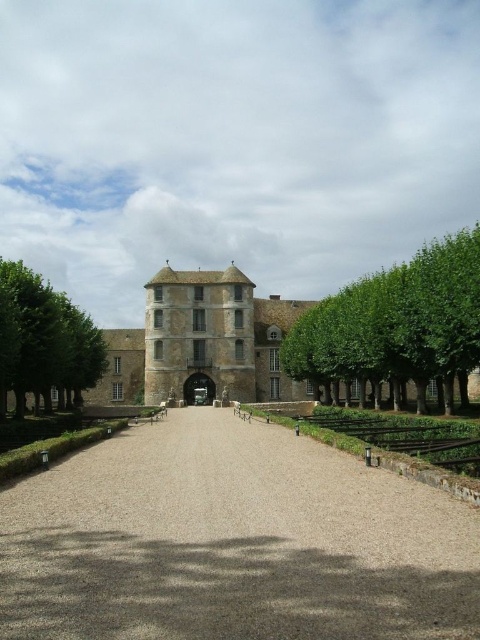
Question: Can you confirm if gray gravel driveway at center is bigger than green leafy tree at center?

Choices:
 (A) yes
 (B) no

Answer: (B)

Question: Which of the following is the farthest from the observer?

Choices:
 (A) click(182, 589)
 (B) click(295, 339)

Answer: (B)

Question: Does gray gravel driveway at center appear on the left side of green leafy tree at left?

Choices:
 (A) yes
 (B) no

Answer: (B)

Question: Does green leafy tree at center appear on the right side of green leafy tree at left?

Choices:
 (A) no
 (B) yes

Answer: (B)

Question: Estimate the real-world distances between objects in this image. Which object is farther from the green leafy tree at center?

Choices:
 (A) green leafy tree at left
 (B) gray gravel driveway at center

Answer: (A)

Question: Which object appears closest to the camera in this image?

Choices:
 (A) green leafy tree at center
 (B) gray gravel driveway at center
 (C) green leafy tree at left

Answer: (B)